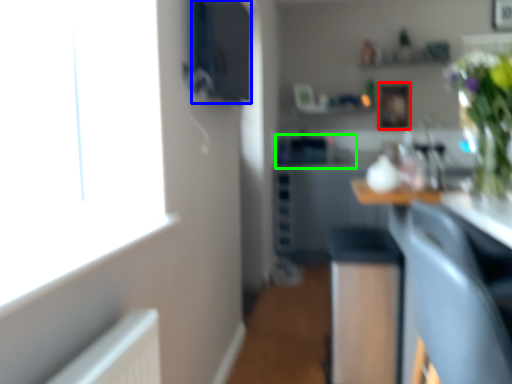
Question: Considering the real-world distances, which object is farthest from picture frame (highlighted by a red box)? appliance (highlighted by a blue box) or sink (highlighted by a green box)?

Choices:
 (A) appliance
 (B) sink

Answer: (A)